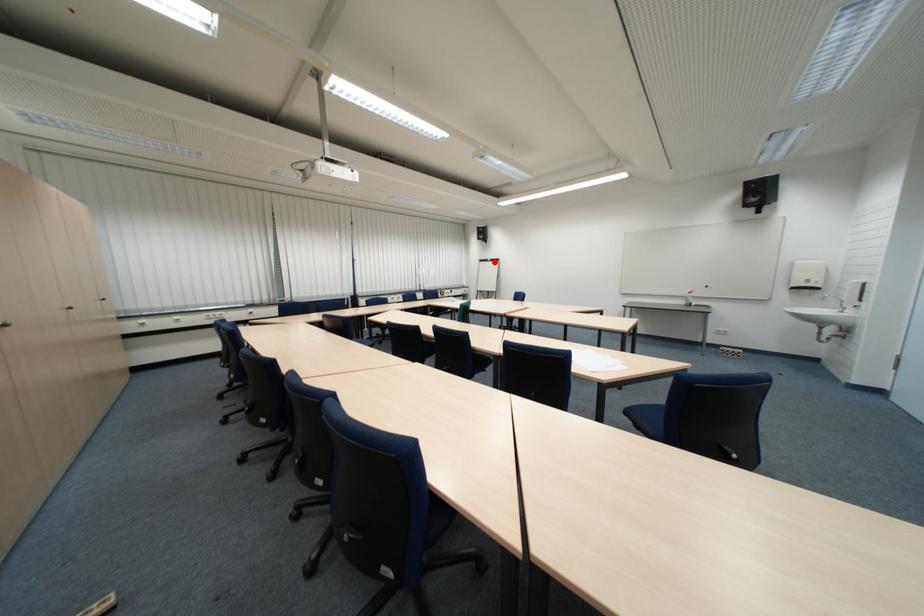
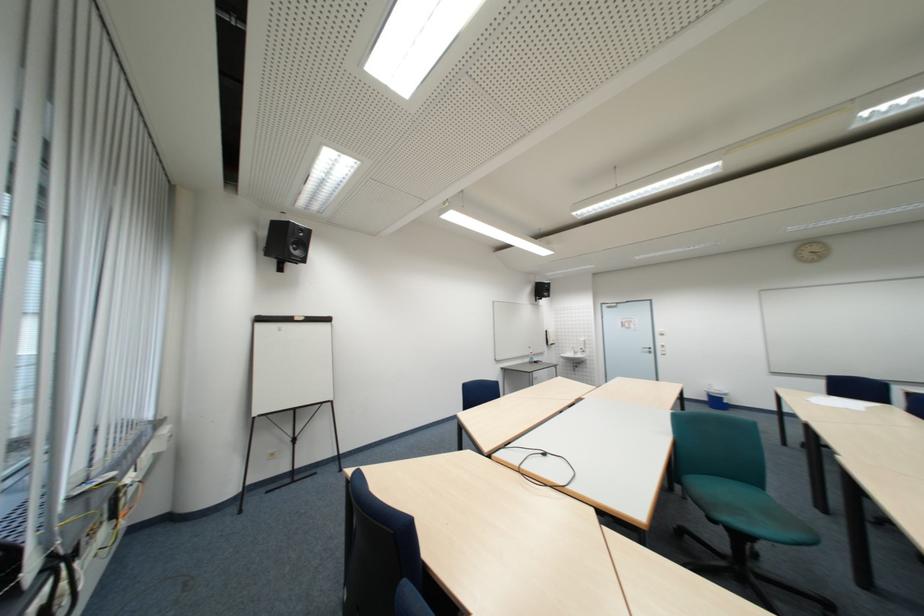
In the second image, find the point that corresponds to the highlighted location in the first image.

(273, 321)